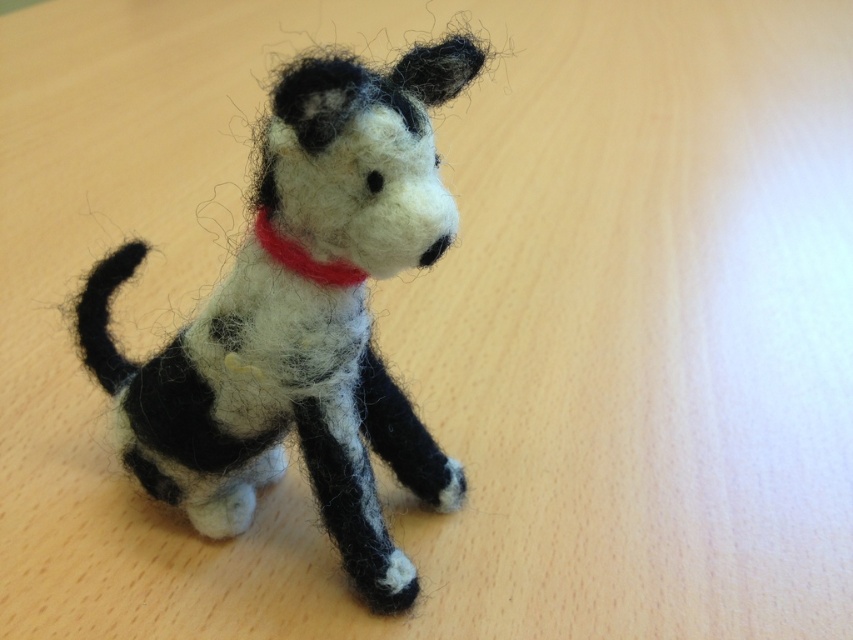
Question: Does fuzzy woolen dog at center come in front of red felt neckband at center?

Choices:
 (A) no
 (B) yes

Answer: (B)

Question: From the image, what is the correct spatial relationship of fuzzy woolen dog at center in relation to red felt neckband at center?

Choices:
 (A) right
 (B) left

Answer: (B)

Question: Is fuzzy woolen dog at center below red felt neckband at center?

Choices:
 (A) no
 (B) yes

Answer: (B)